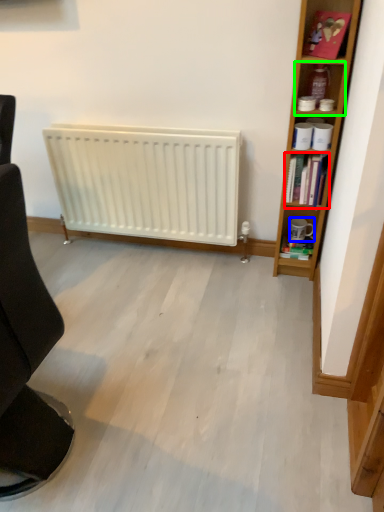
Question: Estimate the real-world distances between objects in this image. Which object is closer to book (highlighted by a red box), coffee cup (highlighted by a blue box) or shelf (highlighted by a green box)?

Choices:
 (A) coffee cup
 (B) shelf

Answer: (B)